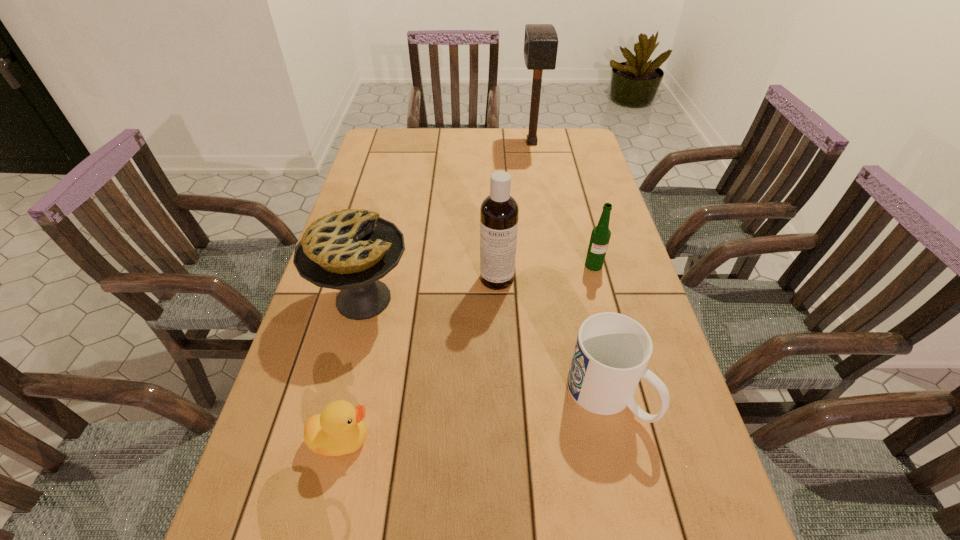
In the image, there is a desktop. Identify the location of vacant space at the left edge. (385, 163).

You are a GUI agent. You are given a task and a screenshot of the screen. Output one action in this format:
    pyautogui.click(x=<x>, y=<y>)
    Task: Click on the vacant space at the right edge
    
    Given the screenshot: What is the action you would take?
    pyautogui.click(x=697, y=463)

Image resolution: width=960 pixels, height=540 pixels. I want to click on free location at the far right corner, so click(x=587, y=146).

Locate an element on the screen. The image size is (960, 540). free space that is in between the fourth object from right to left and the pie is located at coordinates (430, 289).

Identify the location of free space that is in between the fourth object from right to left and the beer bottle. (545, 272).

You are a GUI agent. You are given a task and a screenshot of the screen. Output one action in this format:
    pyautogui.click(x=<x>, y=<y>)
    Task: Click on the empty space between the pie and the shortest object
    
    Given the screenshot: What is the action you would take?
    pyautogui.click(x=352, y=369)

Image resolution: width=960 pixels, height=540 pixels. I want to click on blank region between the mug and the shortest object, so click(474, 417).

Image resolution: width=960 pixels, height=540 pixels. What are the coordinates of `free point between the fourth object from right to left and the beer bottle` in the screenshot? It's located at (545, 272).

Find the location of `the fourth closest object to the farthest object`. the fourth closest object to the farthest object is located at coordinates click(x=612, y=350).

Identify which object is located as the fourth nearest to the duck. Please provide its 2D coordinates. Your answer should be formatted as a tuple, i.e. [(x, y)], where the tuple contains the x and y coordinates of a point satisfying the conditions above.

[(600, 236)]